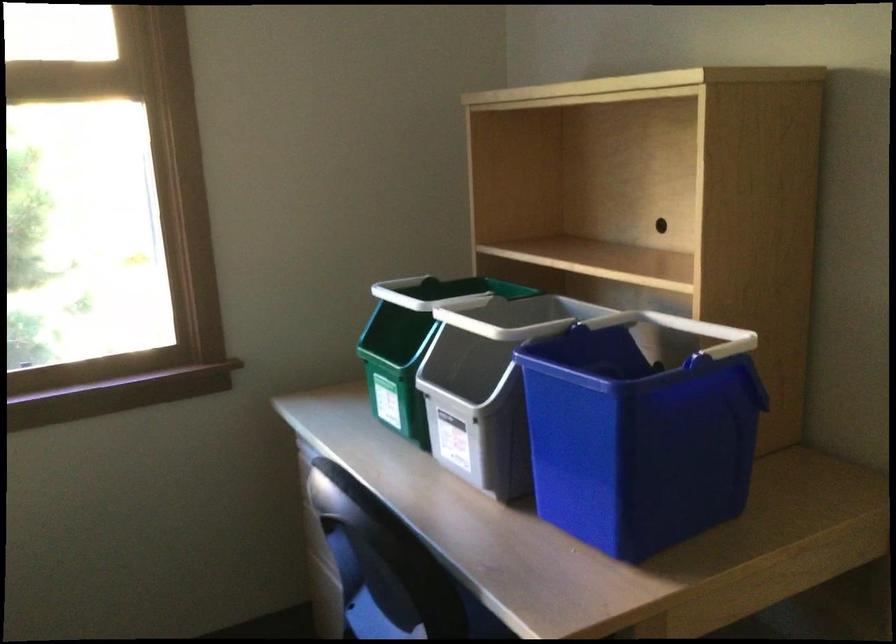
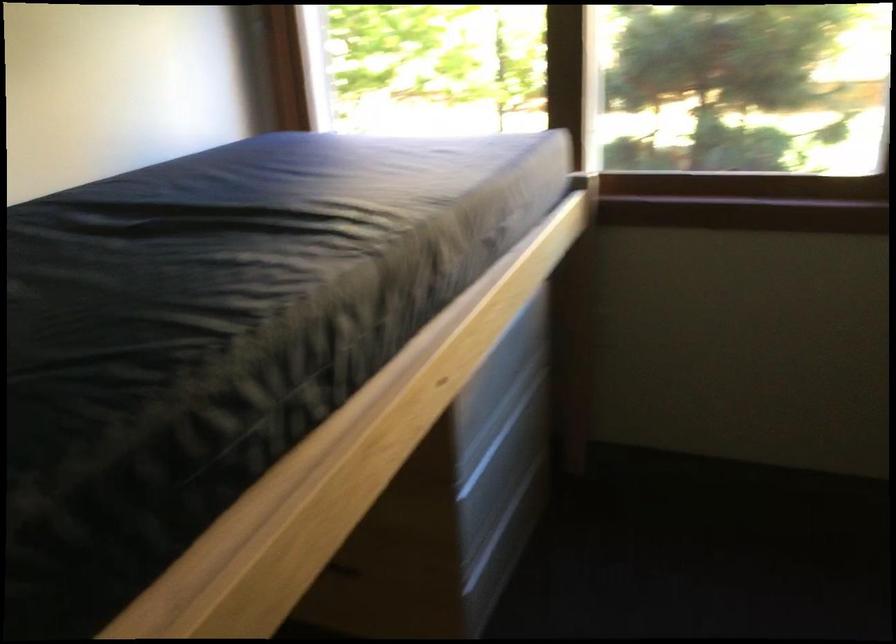
The first image is from the beginning of the video and the second image is from the end. How did the camera likely rotate when shooting the video?

The rotation direction of the camera is left-down.